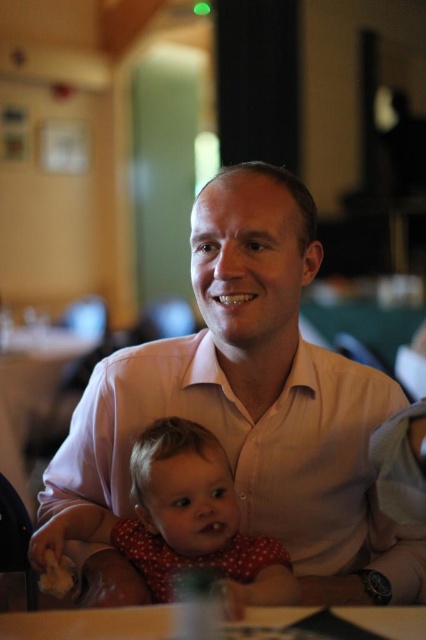
Question: In this image, where is polka dot fabric baby at center located relative to white glossy table at lower center?

Choices:
 (A) right
 (B) left

Answer: (B)

Question: Which object is positioned closest to the white glossy table at lower center?

Choices:
 (A) pink smooth shirt at center
 (B) polka dot fabric baby at center

Answer: (B)

Question: Is pink smooth shirt at center positioned in front of white glossy table at lower center?

Choices:
 (A) no
 (B) yes

Answer: (A)

Question: Which of the following is the farthest from the observer?

Choices:
 (A) pink smooth shirt at center
 (B) polka dot fabric baby at center
 (C) white glossy table at lower center

Answer: (A)

Question: Can you confirm if pink smooth shirt at center is smaller than white glossy table at lower center?

Choices:
 (A) yes
 (B) no

Answer: (B)

Question: Among these points, which one is nearest to the camera?

Choices:
 (A) (325, 592)
 (B) (63, 536)
 (C) (389, 625)

Answer: (C)